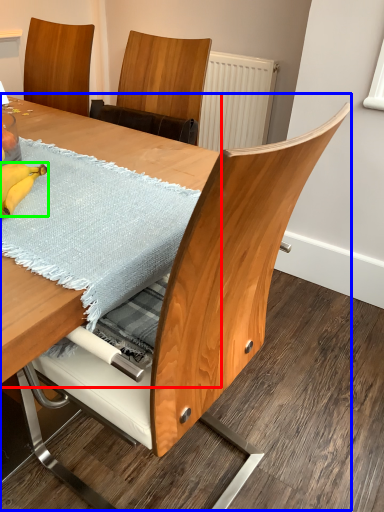
Question: Considering the real-world distances, which object is closest to table (highlighted by a red box)? table (highlighted by a blue box) or banana (highlighted by a green box).

Choices:
 (A) table
 (B) banana

Answer: (B)